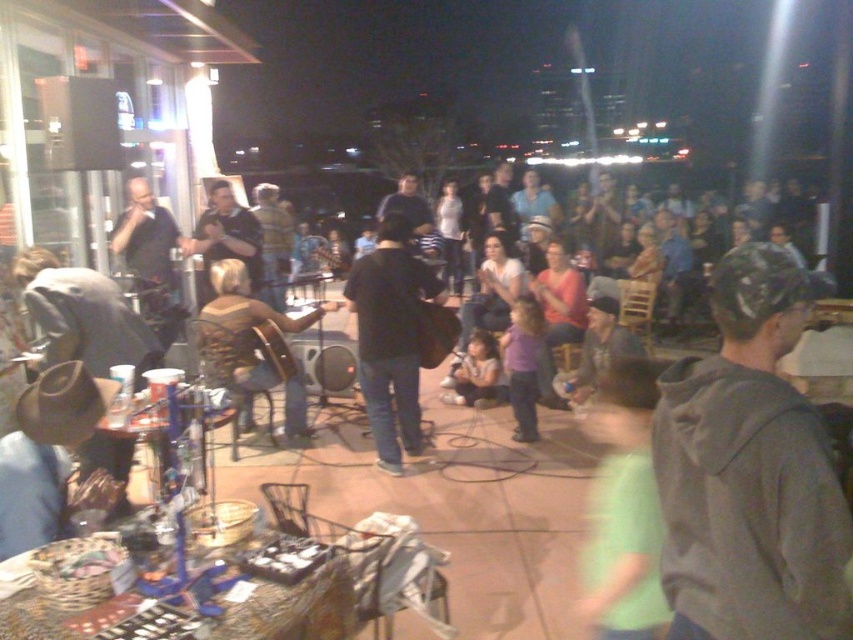
Does gray matte hoodie at center appear on the right side of brown leather guitar at center?

Yes, gray matte hoodie at center is to the right of brown leather guitar at center.

Is point (738, 417) farther from viewer compared to point (236, 355)?

That is False.

What do you see at coordinates (750, 470) in the screenshot? This screenshot has width=853, height=640. I see `gray matte hoodie at center` at bounding box center [750, 470].

This screenshot has width=853, height=640. In order to click on gray matte hoodie at center in this screenshot , I will do `click(750, 470)`.

At what (x,y) coordinates should I click in order to perform the action: click on gray matte hoodie at center. Please return your answer as a coordinate pair (x, y). Looking at the image, I should click on (750, 470).

Who is more forward, [741,493] or [409,404]?

Point [741,493] is in front.

At what (x,y) coordinates should I click in order to perform the action: click on gray matte hoodie at center. Please return your answer as a coordinate pair (x, y). Looking at the image, I should click on (750, 470).

Is black leather jacket at center to the right of brown leather guitar at center from the viewer's perspective?

Correct, you'll find black leather jacket at center to the right of brown leather guitar at center.

Between black leather jacket at center and brown leather guitar at center, which one is positioned higher?

Positioned higher is black leather jacket at center.

Is point (370, 298) more distant than point (291, 381)?

No.

Find the location of a particular element. The image size is (853, 640). black leather jacket at center is located at coordinates (390, 337).